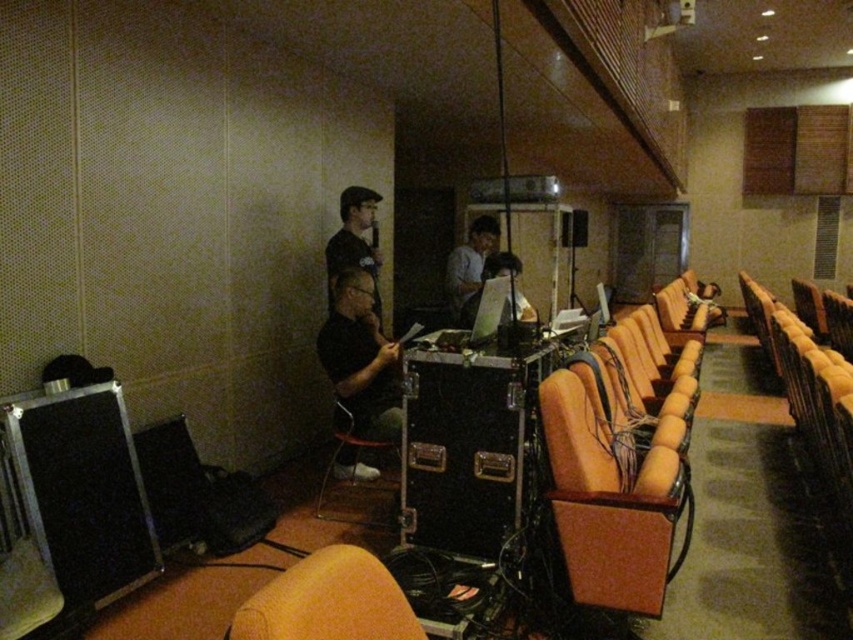
Question: Can you confirm if metallic black speaker at lower left is positioned to the left of dark blue shirt at center?

Choices:
 (A) yes
 (B) no

Answer: (A)

Question: Which object appears farthest from the camera in this image?

Choices:
 (A) matte black laptop at center
 (B) matte black shirt at center

Answer: (A)

Question: Which object is farther from the camera taking this photo?

Choices:
 (A) light blue shirt at center
 (B) orange fabric chair at lower center
 (C) orange fabric chair at lower right

Answer: (A)

Question: Which is nearer to the metallic silver speaker at center?

Choices:
 (A) orange fabric chair at lower center
 (B) matte black laptop at center
 (C) metallic black speaker at lower left
 (D) dark blue shirt at center

Answer: (B)

Question: Is metallic black speaker at lower left smaller than dark blue shirt at center?

Choices:
 (A) yes
 (B) no

Answer: (A)

Question: Is metallic black speaker at lower left further to the viewer compared to metallic silver speaker at center?

Choices:
 (A) yes
 (B) no

Answer: (B)